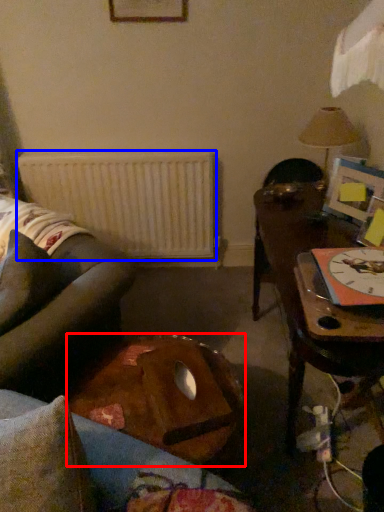
Question: Which point is further to the camera, table (highlighted by a red box) or radiator (highlighted by a blue box)?

Choices:
 (A) table
 (B) radiator

Answer: (B)